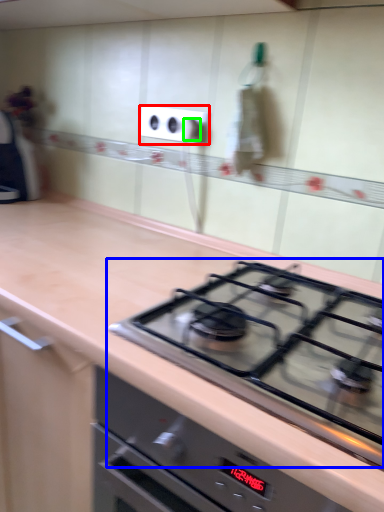
Question: Considering the real-world distances, which object is closest to electric outlet (highlighted by a red box)? gas stove (highlighted by a blue box) or knob (highlighted by a green box).

Choices:
 (A) gas stove
 (B) knob

Answer: (B)